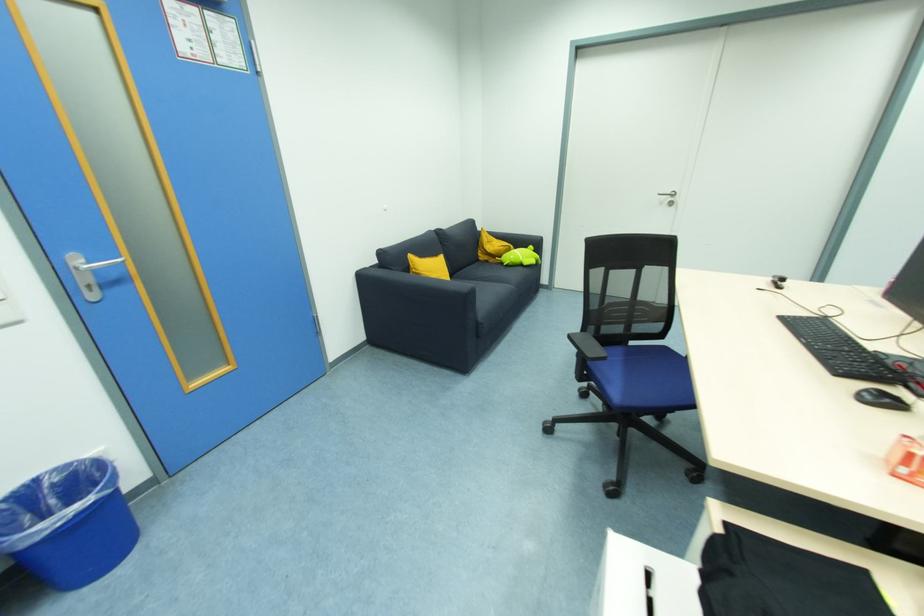
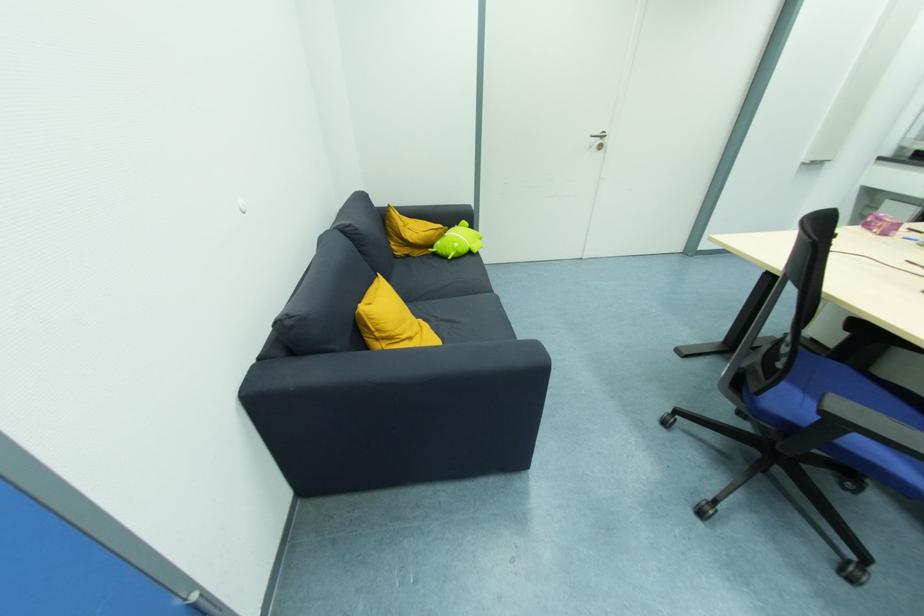
The point at (675, 205) is marked in the first image. Where is the corresponding point in the second image?

(603, 148)